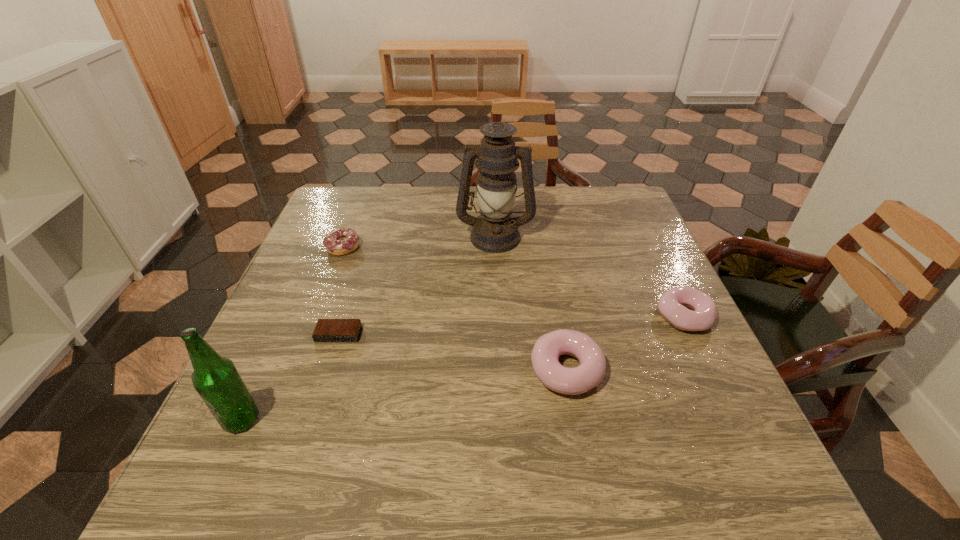
I want to click on free space located on the back of the tallest doughnut, so click(557, 314).

In order to click on vacant space located 0.280m on the back of the rightmost doughnut in this screenshot , I will do `click(642, 230)`.

In order to click on vacant region located 0.340m on the left of the oil lamp in this screenshot , I will do `click(335, 236)`.

Where is `blank space located on the front face of the shortest object`? blank space located on the front face of the shortest object is located at coordinates (305, 438).

Find the location of a particular element. This screenshot has width=960, height=540. vacant space situated 0.130m on the front of the second shortest object is located at coordinates (325, 292).

The width and height of the screenshot is (960, 540). In order to click on object that is at the far edge in this screenshot , I will do `click(495, 231)`.

Where is `doughnut that is at the near edge`? doughnut that is at the near edge is located at coordinates (590, 372).

At what (x,y) coordinates should I click in order to perform the action: click on beer bottle situated at the near edge. Please return your answer as a coordinate pair (x, y). Image resolution: width=960 pixels, height=540 pixels. Looking at the image, I should click on 216,379.

Where is `alarm clock positioned at the left edge`? The height and width of the screenshot is (540, 960). alarm clock positioned at the left edge is located at coordinates (326, 330).

Identify the location of doughnut located in the left edge section of the desktop. (341, 241).